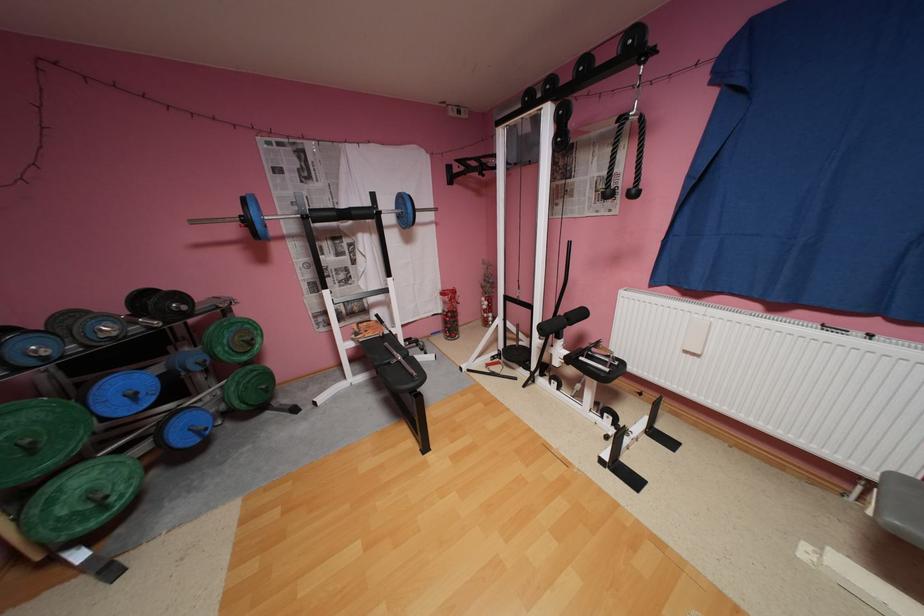
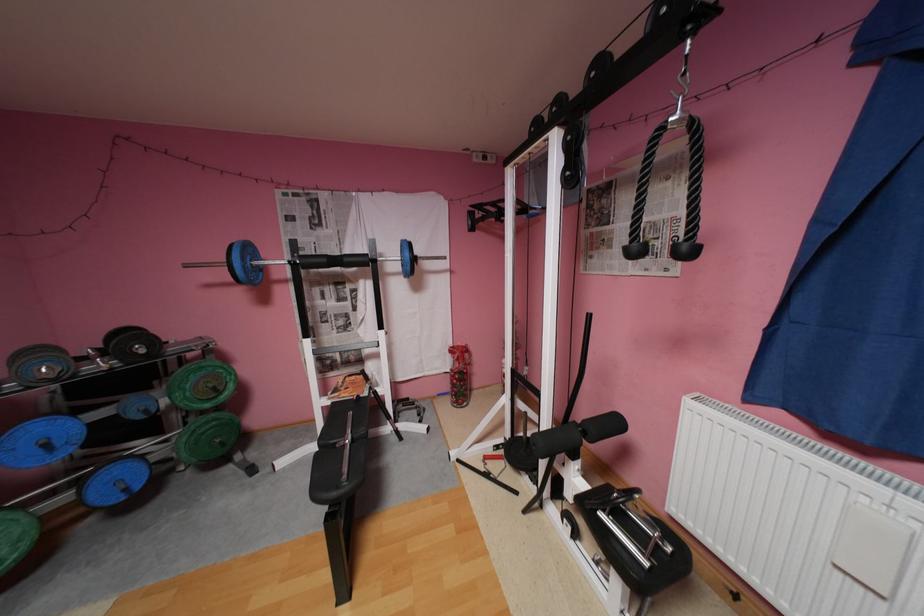
Locate, in the second image, the point that corresponds to (362,213) in the first image.

(355, 259)